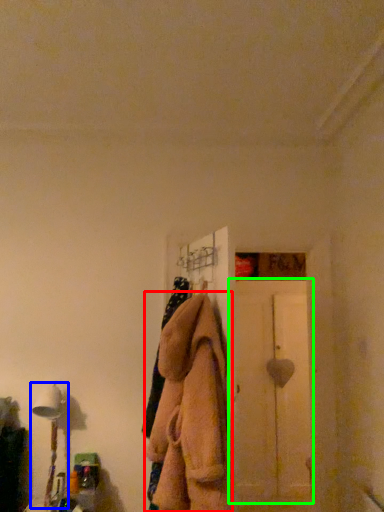
Question: Which object is the closest to the clothing (highlighted by a red box)? Choose among these: table lamp (highlighted by a blue box) or screen door (highlighted by a green box).

Choices:
 (A) table lamp
 (B) screen door

Answer: (A)